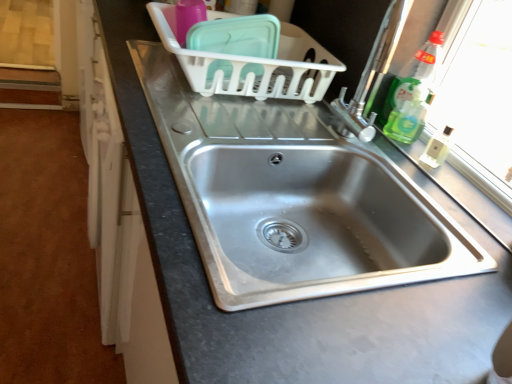
Question: Is clear plastic bottle at upper right, positioned as the 1th bottle in top-to-bottom order, in front of or behind stainless steel sink at center, which is the 1th sink from bottom to top, in the image?

Choices:
 (A) behind
 (B) front

Answer: (A)

Question: Do you think clear plastic bottle at upper right, the 2th bottle from the bottom, is within stainless steel sink at center, which is the 1th sink from bottom to top, or outside of it?

Choices:
 (A) inside
 (B) outside

Answer: (B)

Question: Estimate the real-world distances between objects in this image. Which object is farther from the satin nickel faucet at right?

Choices:
 (A) stainless steel sink at center, which is the 1th sink from bottom to top
 (B) stainless steel sink at center, which is the second sink in bottom-to-top order
 (C) clear plastic soap dispenser at right
 (D) green translucent liquid at right, the second bottle from the top
 (E) clear plastic bottle at upper right, the 2th bottle from the bottom

Answer: (A)

Question: Considering the real-world distances, which object is closest to the white plastic basket at upper center?

Choices:
 (A) satin nickel faucet at right
 (B) stainless steel sink at center, which is the second sink in bottom-to-top order
 (C) green translucent liquid at right, the first bottle from the bottom
 (D) clear plastic bottle at upper right, the 2th bottle from the bottom
 (E) stainless steel sink at center, which is the 1th sink from bottom to top

Answer: (A)